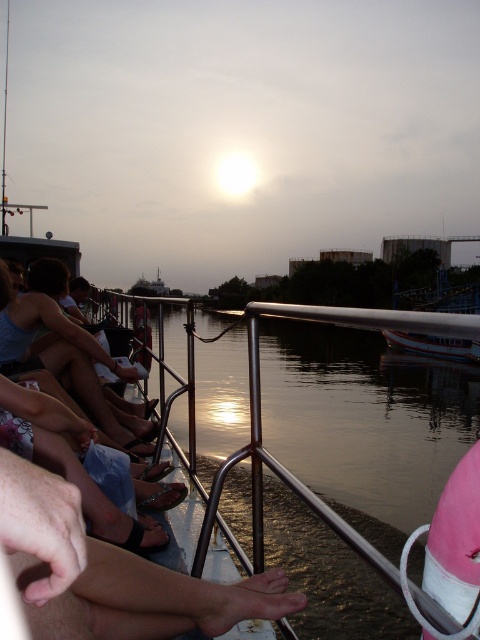
Question: Is smooth skin leg at lower center below metallic water at lower center?

Choices:
 (A) yes
 (B) no

Answer: (A)

Question: Considering the relative positions of metallic water at lower center and matte black shorts at left in the image provided, where is metallic water at lower center located with respect to matte black shorts at left?

Choices:
 (A) right
 (B) left

Answer: (A)

Question: Which object is closer to the camera taking this photo?

Choices:
 (A) metallic water at lower center
 (B) matte black shorts at left
 (C) smooth skin leg at lower center

Answer: (C)

Question: Which of these objects is positioned closest to the matte black shorts at left?

Choices:
 (A) metallic water at lower center
 (B) smooth skin leg at lower center

Answer: (A)

Question: Considering the relative positions of smooth skin leg at lower center and metallic water at lower center in the image provided, where is smooth skin leg at lower center located with respect to metallic water at lower center?

Choices:
 (A) above
 (B) below

Answer: (B)

Question: Among these objects, which one is farthest from the camera?

Choices:
 (A) metallic water at lower center
 (B) matte black shorts at left

Answer: (B)